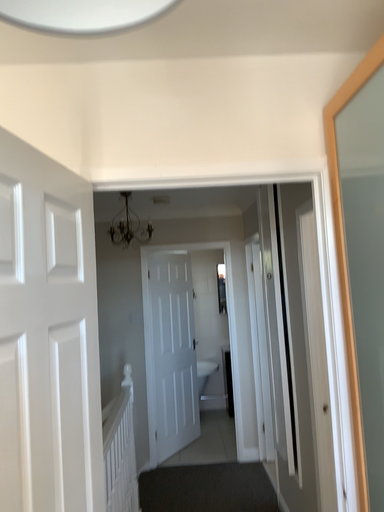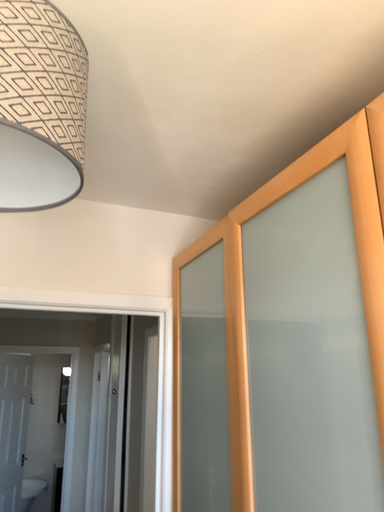
Question: Which way did the camera rotate in the video?

Choices:
 (A) rotated upward
 (B) rotated downward

Answer: (A)